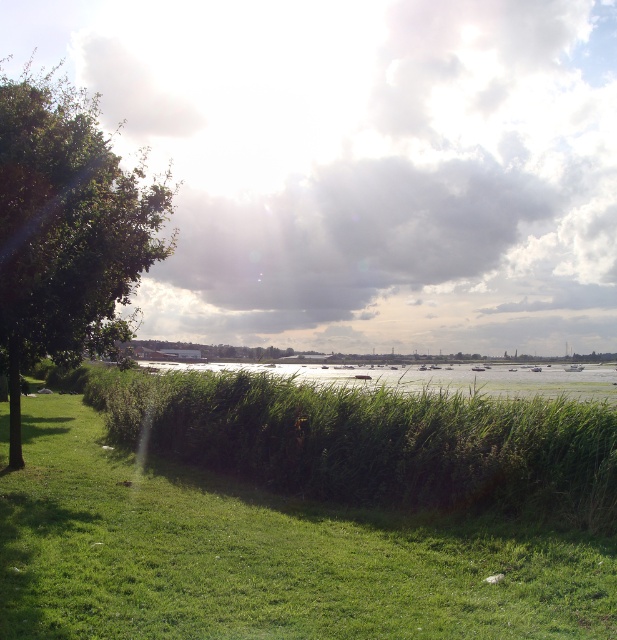
Looking at this image, does green grassy hedge at center have a lesser height compared to green grassy water at center?

Correct, green grassy hedge at center is not as tall as green grassy water at center.

Is green grassy hedge at center further to the viewer compared to green grassy water at center?

No.

Does point (441, 420) come behind point (569, 385)?

That is False.

Find the location of `green grassy hedge at center`. green grassy hedge at center is located at coordinates (375, 442).

Which is above, green grassy hedge at center or green leafy tree at left?

Positioned higher is green leafy tree at left.

Can you confirm if green grassy hedge at center is shorter than green leafy tree at left?

Yes.

What do you see at coordinates (375, 442) in the screenshot?
I see `green grassy hedge at center` at bounding box center [375, 442].

Where is `green grassy hedge at center`? green grassy hedge at center is located at coordinates click(x=375, y=442).

Does green leafy tree at left appear over green grassy water at center?

Yes, green leafy tree at left is above green grassy water at center.

Which is more to the right, green leafy tree at left or green grassy water at center?

green grassy water at center

Who is more forward, (99, 337) or (445, 387)?

Point (99, 337)

Where is `green leafy tree at left`? green leafy tree at left is located at coordinates (67, 230).